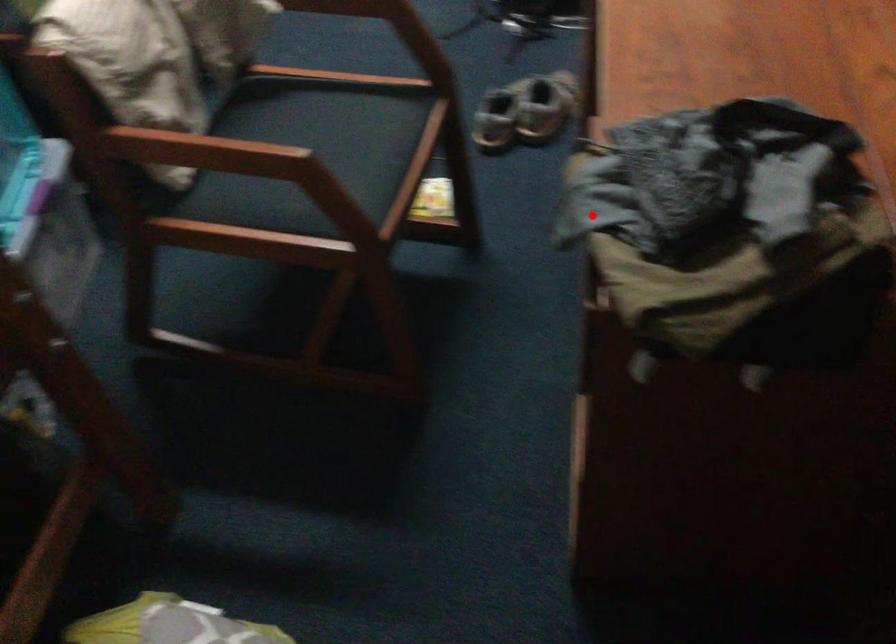
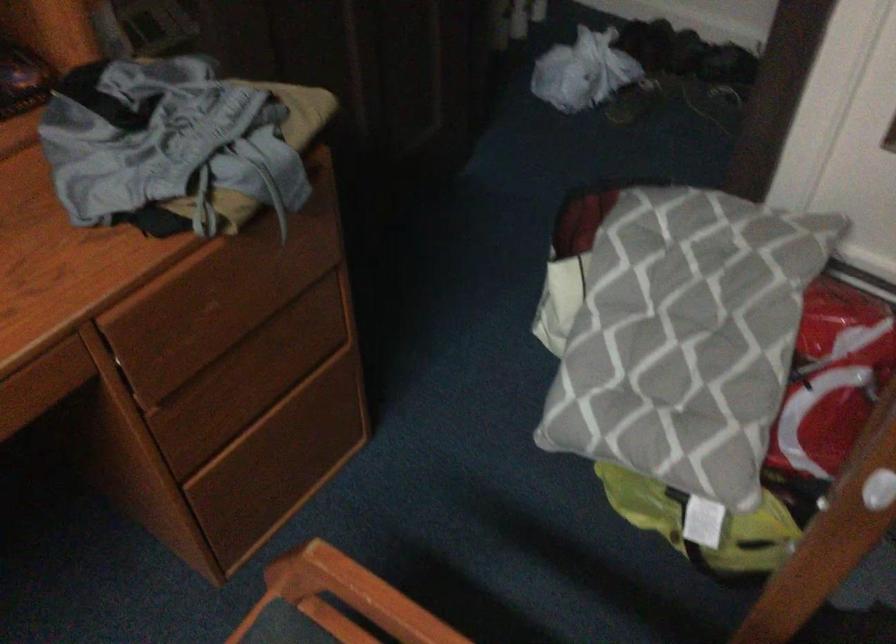
Where in the second image is the point corresponding to the highlighted location from the first image?

(196, 294)